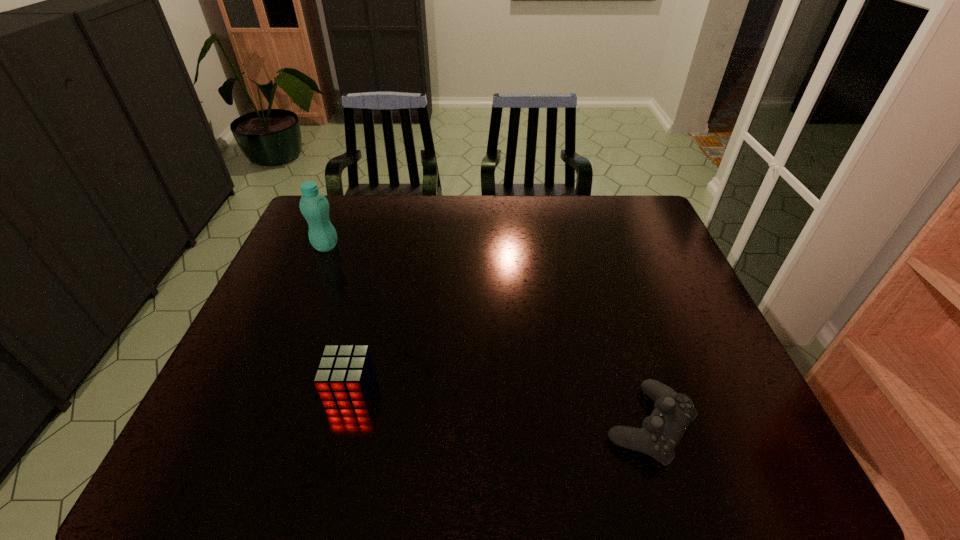
Find the location of a particular element. Image resolution: width=960 pixels, height=540 pixels. the leftmost object is located at coordinates (314, 206).

In order to click on the tallest object in this screenshot , I will do `click(314, 206)`.

Where is `the second tallest object`? This screenshot has width=960, height=540. the second tallest object is located at coordinates (345, 375).

You are a GUI agent. You are given a task and a screenshot of the screen. Output one action in this format:
    pyautogui.click(x=<x>, y=<y>)
    Task: Click on the cube
    The image size is (960, 540).
    Given the screenshot: What is the action you would take?
    pyautogui.click(x=345, y=375)

The height and width of the screenshot is (540, 960). What are the coordinates of `control` in the screenshot? It's located at (661, 432).

At what (x,y) coordinates should I click in order to perform the action: click on the shortest object. Please return your answer as a coordinate pair (x, y). Looking at the image, I should click on (661, 432).

Locate an element on the screen. The height and width of the screenshot is (540, 960). vacant space located 0.350m on the front of the leftmost object is located at coordinates (286, 342).

The height and width of the screenshot is (540, 960). Identify the location of free space located on the front of the cube. (337, 443).

Where is `free space located 0.320m on the back of the rightmost object`? free space located 0.320m on the back of the rightmost object is located at coordinates (607, 290).

Identify the location of object that is at the near edge. (661, 432).